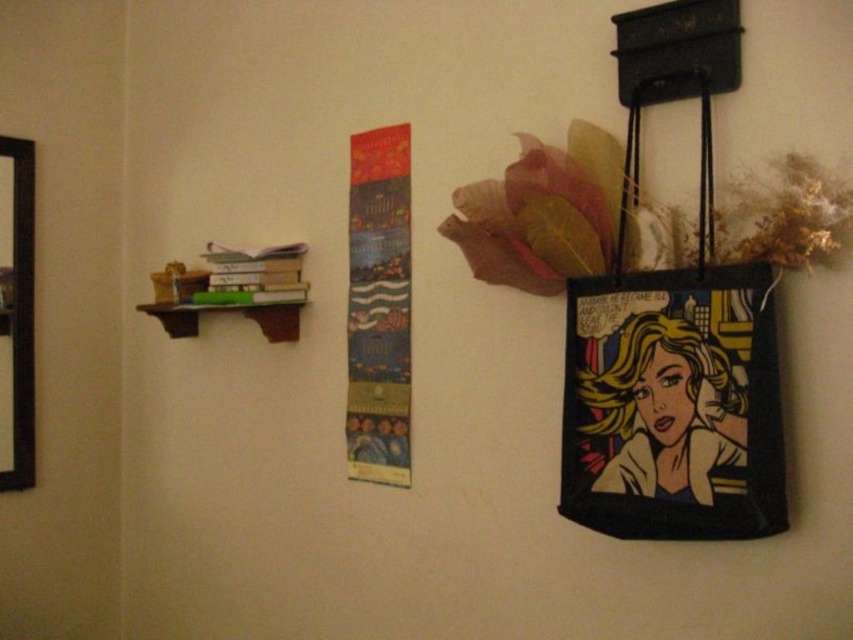
Question: Which object is closer to the camera taking this photo?

Choices:
 (A) pop art tote bag at upper right
 (B) black wooden picture frame at left

Answer: (A)

Question: Among these objects, which one is nearest to the camera?

Choices:
 (A) textured fabric banner at center
 (B) black wooden picture frame at left
 (C) pop art tote bag at upper right

Answer: (C)

Question: Can you confirm if pop art tote bag at upper right is bigger than black wooden picture frame at left?

Choices:
 (A) no
 (B) yes

Answer: (B)

Question: Does pop art tote bag at upper right have a lesser width compared to black wooden picture frame at left?

Choices:
 (A) no
 (B) yes

Answer: (A)

Question: Is pop art tote bag at upper right wider than black wooden picture frame at left?

Choices:
 (A) no
 (B) yes

Answer: (B)

Question: Which of the following is the closest to the observer?

Choices:
 (A) black wooden picture frame at left
 (B) pop art tote bag at upper right
 (C) textured fabric banner at center

Answer: (B)